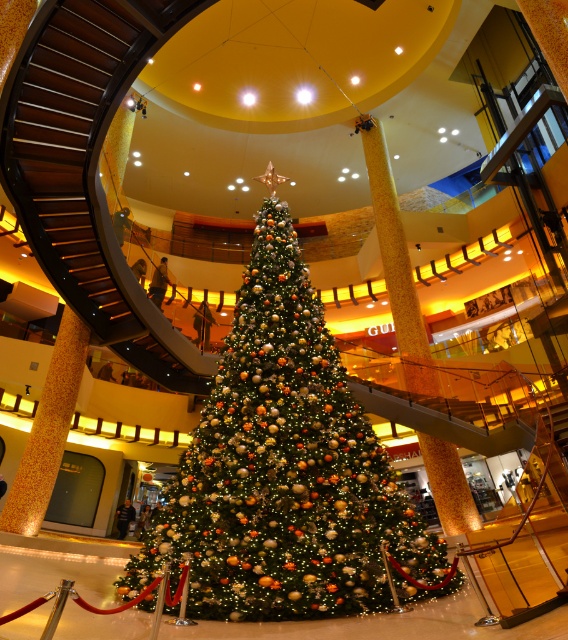
You are a visitor at the mall and want to take a photo of the shiny metallic christmas tree at center without the brown wooden stairs at center appearing in the shot. How should you position yourself?

Since the shiny metallic christmas tree at center is closer to the viewer than the brown wooden stairs at center, you should move closer to the tree and angle your camera so that the stairs are out of the frame behind the tree.

You are standing in the mall and want to take a photo of both the Christmas tree and the star at the top. You notice two points marked on the floor where you can stand to take the picture. The first point is at coordinate point (215, 490) and the second is at point (39, 33). Which point should you choose to ensure the star on top of the tree is clearly visible in your photo?

You should choose point (215, 490) because it is closer to the viewer than point (39, 33), allowing for a clearer view of the star at the top of the Christmas tree.

In the scene shown: You are a visitor at the mall and want to take a photo of the shiny metallic christmas tree at center from the top of the brown wooden stairs at center. Is the tree visible from there?

The shiny metallic christmas tree at center is located below the brown wooden stairs at center, so yes, the tree is visible from the top of the stairs.